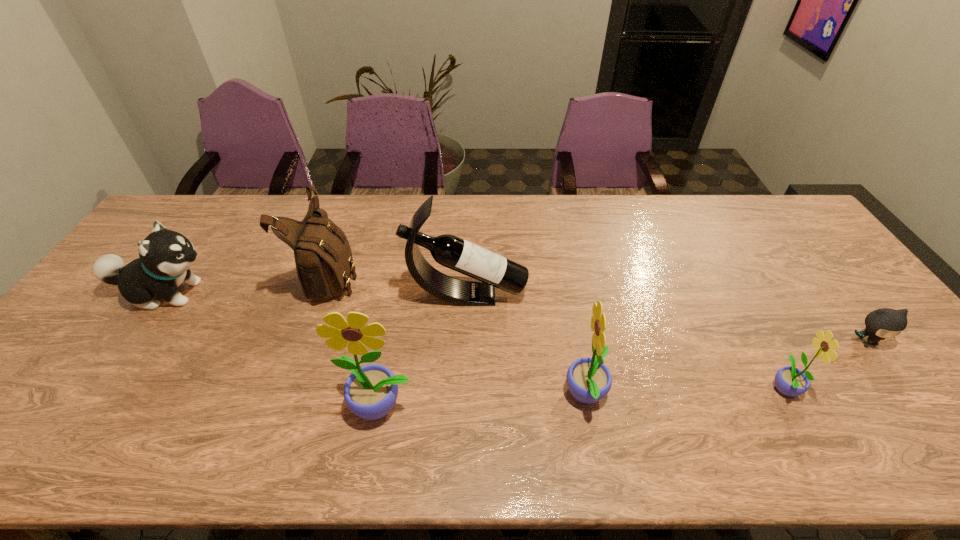
The sunflowers are evenly distributed in the image. To maintain this, where would you place another sunflower on the left? Please point to a free space. Please provide its 2D coordinates. Your answer should be formatted as a tuple, i.e. [(x, y)], where the tuple contains the x and y coordinates of a point satisfying the conditions above.

[(169, 416)]